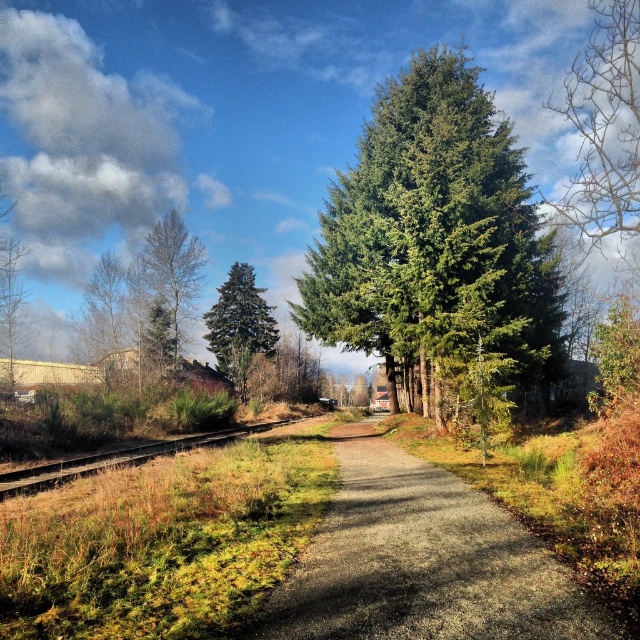
You are standing at the start of the gravel path at center and want to reach the bare branches at upper right. Which direction should you walk to get closer to them?

You should walk to the right because the gravel path at center is to the left of the bare branches at upper right, so moving right along the path will bring you closer to them.

You are a hiker walking along the gravel path in the rural scene. You notice the green matte tree at center and the brown wooden train track at left. Which object is closer to you as you walk along the path?

The green matte tree at center is closer to you because it is further to the viewer than the brown wooden train track at left, meaning it appears nearer in the scene.